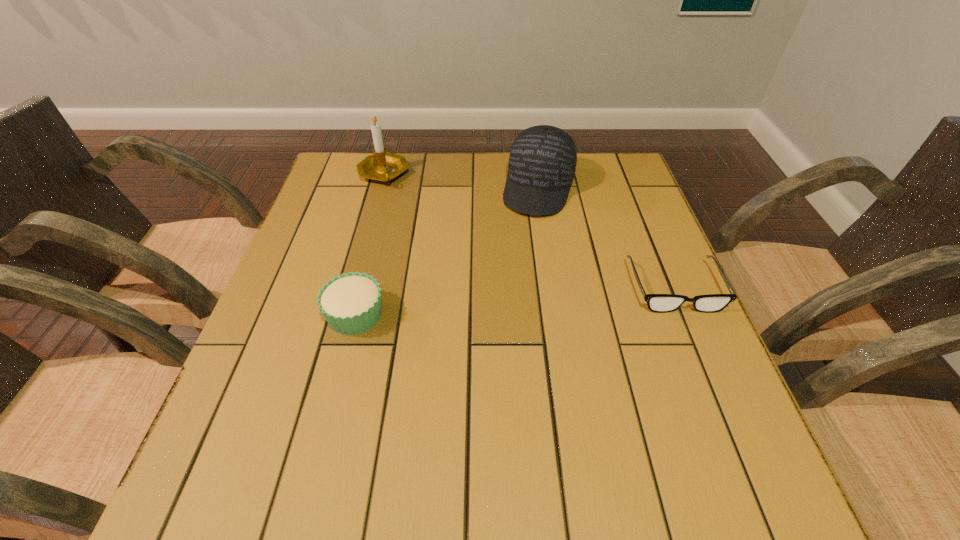
Where is `vacant space on the desktop that is between the third tallest object and the shortest object and is positioned with a handle on the candle holder`? vacant space on the desktop that is between the third tallest object and the shortest object and is positioned with a handle on the candle holder is located at coordinates (549, 298).

The image size is (960, 540). In order to click on vacant spot on the desktop that is between the cupcake and the spectacles and is positioned at the front of the third object from left to right where the brim is located in this screenshot , I will do `click(501, 302)`.